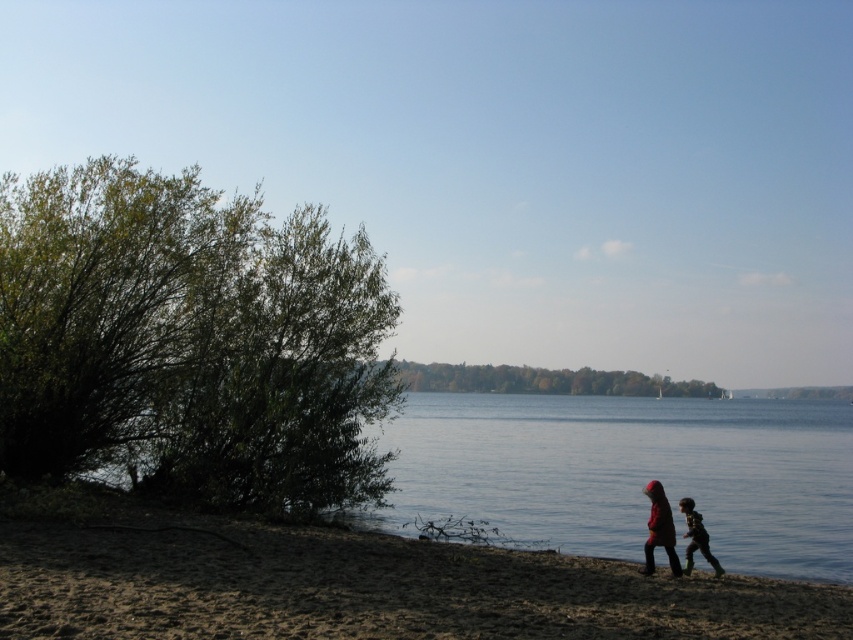
Question: Does red woolen coat at lower right appear on the left side of dark brown textured jacket at lower right?

Choices:
 (A) yes
 (B) no

Answer: (B)

Question: Which point is closer to the camera taking this photo?

Choices:
 (A) (646, 493)
 (B) (300, 580)
 (C) (695, 540)
 (D) (106, 438)

Answer: (B)

Question: Can you confirm if green leafy bush at left is wider than brown sandy beach at lower left?

Choices:
 (A) yes
 (B) no

Answer: (A)

Question: Which point is farther from the camera taking this photo?

Choices:
 (A) (207, 588)
 (B) (51, 252)

Answer: (B)

Question: Which point appears farthest from the camera in this image?

Choices:
 (A) (693, 538)
 (B) (653, 532)

Answer: (A)

Question: Is the position of matte red coat at lower right less distant than that of dark brown textured jacket at lower right?

Choices:
 (A) yes
 (B) no

Answer: (A)